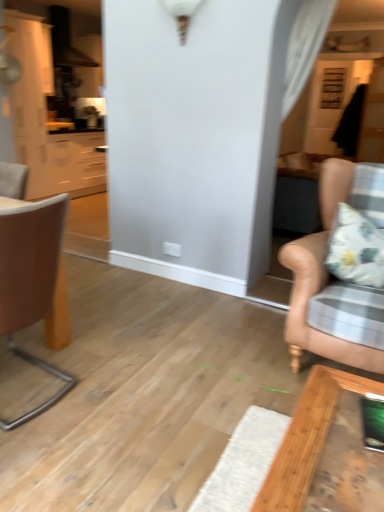
Question: Is point (34, 66) closer or farther from the camera than point (8, 305)?

Choices:
 (A) farther
 (B) closer

Answer: (A)

Question: Relative to brown leather chair at left, which ranks as the first chair in left-to-right order, is matte white cabinets at left in front or behind?

Choices:
 (A) behind
 (B) front

Answer: (A)

Question: Estimate the real-world distances between objects in this image. Which object is closer to the matte white cabinets at left?

Choices:
 (A) brown leather chair at left, which ranks as the first chair in left-to-right order
 (B) leather couch at right, arranged as the second chair when viewed from the left

Answer: (A)

Question: Which object is the closest to the matte white cabinets at left?

Choices:
 (A) leather couch at right, arranged as the second chair when viewed from the left
 (B) brown leather chair at left, positioned as the 2th chair in right-to-left order

Answer: (B)